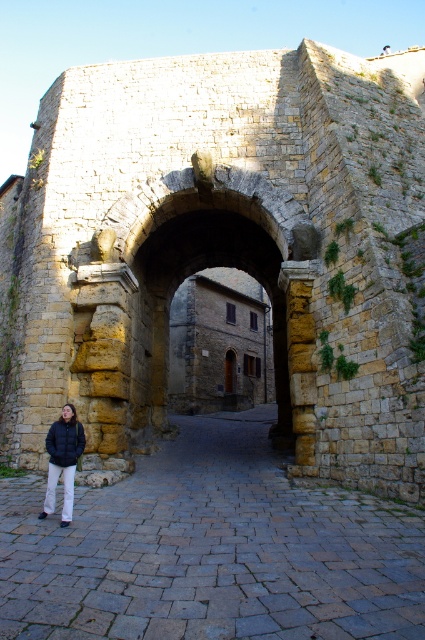
You are a delivery person carrying a large box that is 1.5 meters wide. You need to pass through the stone archway at center. Can you determine if the dark blue puffer jacket at lower left is an obstacle in your path?

The stone archway at center might be wider than dark blue puffer jacket at lower left, so the jacket is not an obstacle as it is narrower than the archway. However, the exact width of the archway is uncertain, so proceed with caution.

Based on the scene description, what are the coordinates of the stone archway at center?

The stone archway at center is located at coordinates point (221, 248).

You are an architect examining the historic stone archway at center and the dark blue puffer jacket at lower left in the image. Based on their sizes, which object would require more materials to construct?

The stone archway at center is bigger than the dark blue puffer jacket at lower left, so it would require more materials to construct.